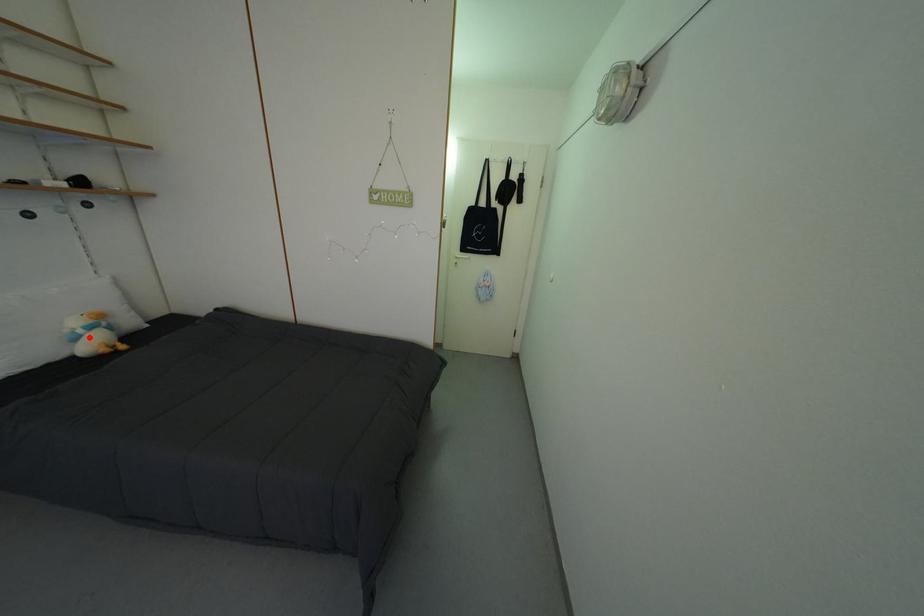
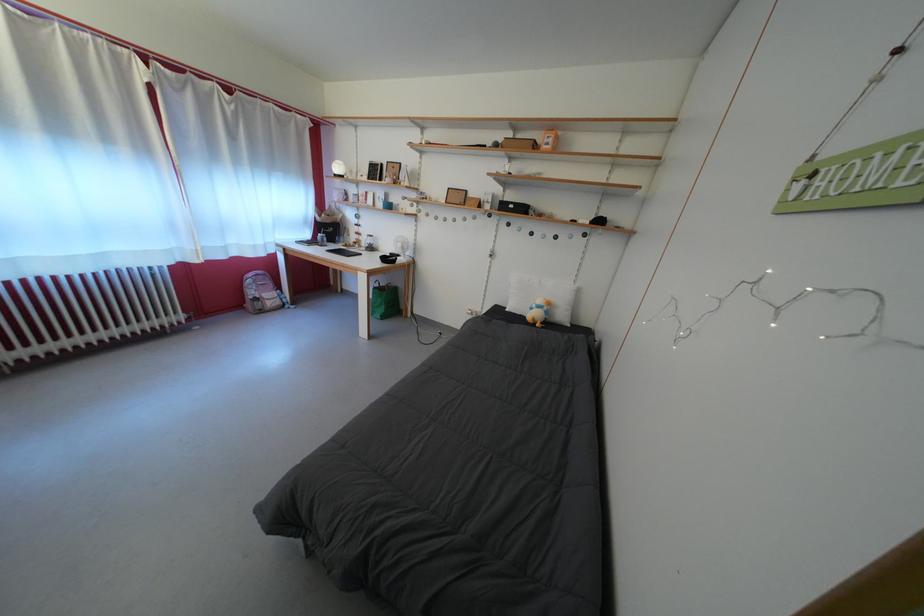
The point at the highlighted location is marked in the first image. Where is the corresponding point in the second image?

(542, 312)